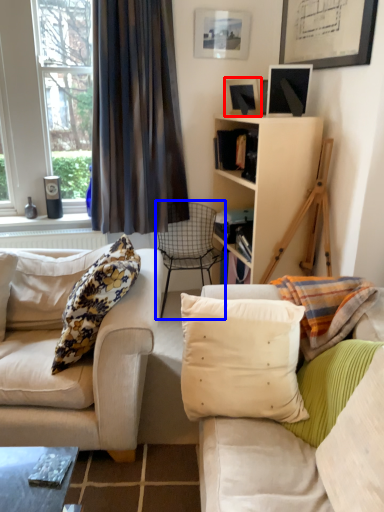
Question: Which object is further to the camera taking this photo, picture frame (highlighted by a red box) or chair (highlighted by a blue box)?

Choices:
 (A) picture frame
 (B) chair

Answer: (B)